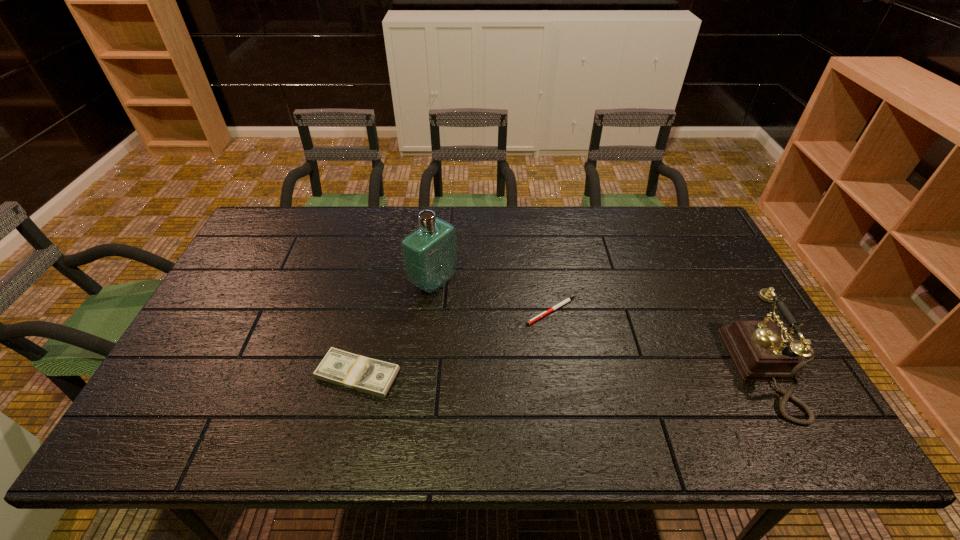
Where is `unoccupied position between the perfume and the shortest object`? unoccupied position between the perfume and the shortest object is located at coordinates (492, 296).

At what (x,y) coordinates should I click in order to perform the action: click on vacant area between the perfume and the telephone. Please return your answer as a coordinate pair (x, y). Looking at the image, I should click on (604, 326).

What are the coordinates of `object that can be found as the third closest to the tallest object` in the screenshot? It's located at (761, 352).

I want to click on object that can be found as the closest to the dollar, so click(429, 253).

Find the location of `free space that satisfies the following two spatial constraints: 1. on the front side of the shortest object; 2. on the dial of the third shortest object`. free space that satisfies the following two spatial constraints: 1. on the front side of the shortest object; 2. on the dial of the third shortest object is located at coordinates (561, 370).

At what (x,y) coordinates should I click in order to perform the action: click on blank area in the image that satisfies the following two spatial constraints: 1. on the front side of the shortest object; 2. on the dial of the third shortest object. Please return your answer as a coordinate pair (x, y). Image resolution: width=960 pixels, height=540 pixels. Looking at the image, I should click on tap(561, 370).

Locate an element on the screen. The image size is (960, 540). free space that satisfies the following two spatial constraints: 1. on the front side of the tallest object; 2. on the left side of the pen is located at coordinates (430, 311).

Locate an element on the screen. Image resolution: width=960 pixels, height=540 pixels. free space in the image that satisfies the following two spatial constraints: 1. on the back side of the dollar; 2. on the left side of the pen is located at coordinates (372, 311).